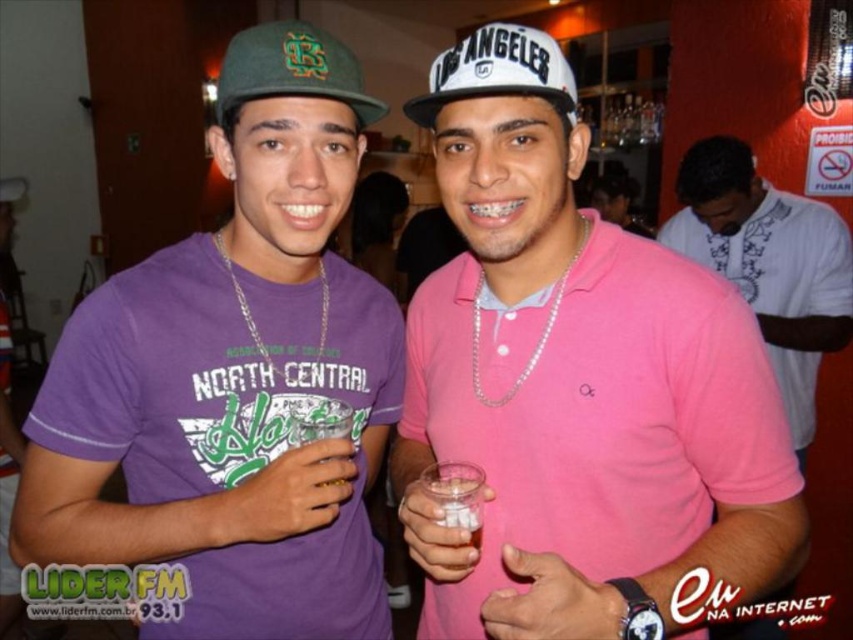
Question: Is pink matte shirt at center above pink cotton shirt at center?

Choices:
 (A) no
 (B) yes

Answer: (A)

Question: Does purple cotton t-shirt at center have a lesser width compared to green felt baseball cap at upper left?

Choices:
 (A) yes
 (B) no

Answer: (B)

Question: Which point appears farthest from the camera in this image?

Choices:
 (A) (473, 513)
 (B) (809, 294)
 (C) (103, 289)

Answer: (B)

Question: Which object appears farthest from the camera in this image?

Choices:
 (A) translucent plastic cup at center
 (B) pink cotton shirt at center
 (C) pink matte shirt at center
 (D) purple cotton t-shirt at center

Answer: (B)

Question: Is pink matte shirt at center to the left of purple cotton t-shirt at center from the viewer's perspective?

Choices:
 (A) no
 (B) yes

Answer: (A)

Question: Among these objects, which one is farthest from the camera?

Choices:
 (A) translucent plastic cup at center
 (B) pink cotton shirt at center
 (C) green felt baseball cap at upper left
 (D) pink matte shirt at center

Answer: (B)